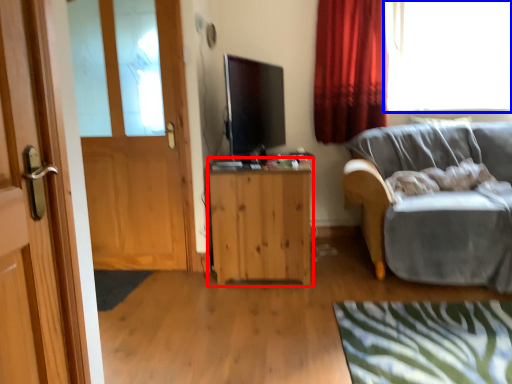
Question: Which point is closer to the camera, cabinetry (highlighted by a red box) or window (highlighted by a blue box)?

Choices:
 (A) cabinetry
 (B) window

Answer: (A)